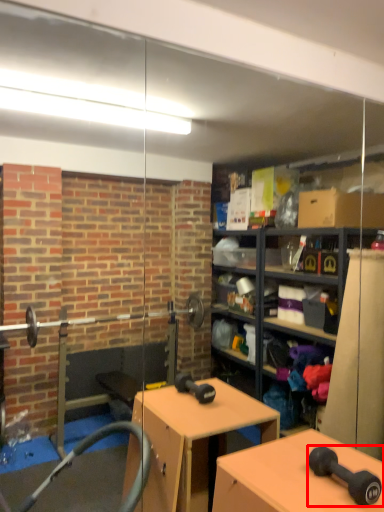
Question: From the image's perspective, considering the relative positions of dumbbell (annotated by the red box) and table in the image provided, where is dumbbell (annotated by the red box) located with respect to the staircase?

Choices:
 (A) above
 (B) below

Answer: (A)